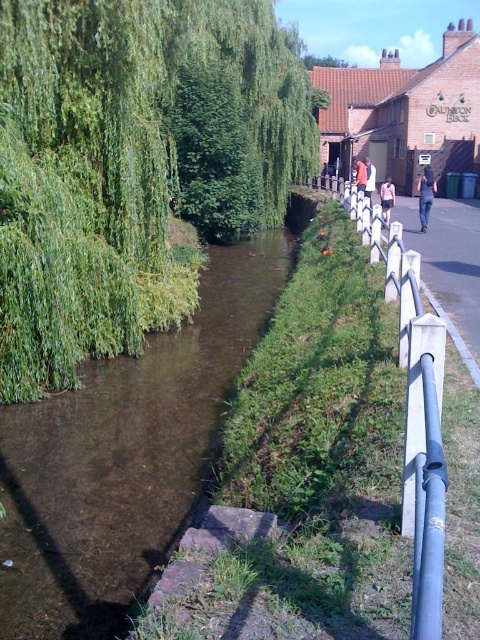
Question: Can you confirm if green leafy tree at upper left is positioned above orange jacket at center?

Choices:
 (A) yes
 (B) no

Answer: (A)

Question: Which point appears closest to the camera in this image?

Choices:
 (A) 420,182
 (B) 124,176
 (C) 365,161

Answer: (B)

Question: Is light blue denim shorts at center bigger than white cotton shirt at center?

Choices:
 (A) no
 (B) yes

Answer: (A)

Question: Does blue painted metal fence at right appear on the right side of jeans at right?

Choices:
 (A) yes
 (B) no

Answer: (B)

Question: Based on their relative distances, which object is nearer to the light blue denim shorts at center?

Choices:
 (A) white cotton shirt at center
 (B) blue painted metal fence at right
 (C) orange jacket at center

Answer: (A)

Question: Which point appears farthest from the camera in this image?

Choices:
 (A) tap(394, 196)
 (B) tap(60, 8)

Answer: (A)